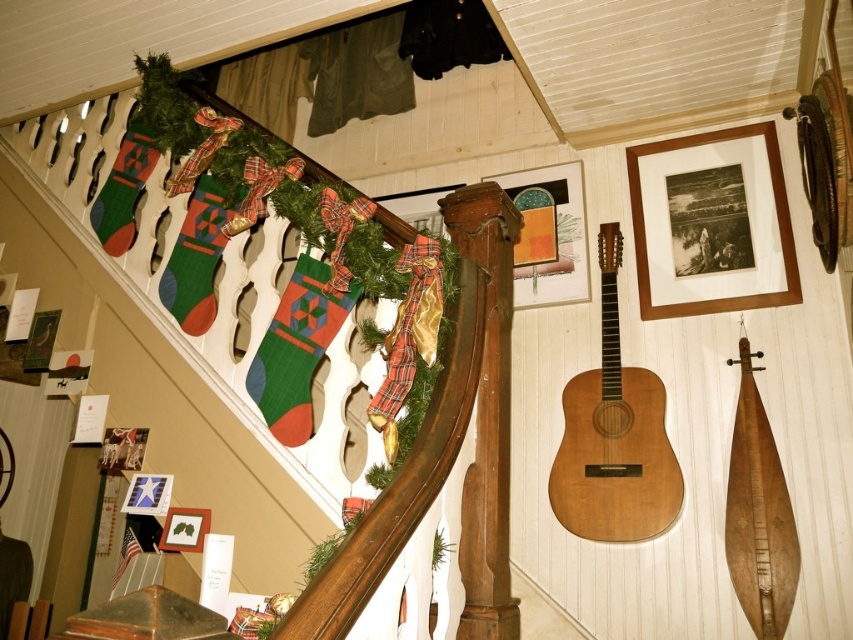
Find the location of `natural wood guitar at center`. natural wood guitar at center is located at coordinates (614, 436).

Is natural wood guitar at center to the left of wooden picture frame at upper right from the viewer's perspective?

Indeed, natural wood guitar at center is positioned on the left side of wooden picture frame at upper right.

Where is `natural wood guitar at center`? natural wood guitar at center is located at coordinates (614, 436).

Can you confirm if natural wood guitar at center is positioned to the right of wooden guitar at center-right?

No, natural wood guitar at center is not to the right of wooden guitar at center-right.

How much distance is there between natural wood guitar at center and wooden guitar at center-right?

natural wood guitar at center and wooden guitar at center-right are 13.47 inches apart from each other.

Describe the element at coordinates (614, 436) in the screenshot. The width and height of the screenshot is (853, 640). I see `natural wood guitar at center` at that location.

I want to click on natural wood guitar at center, so click(614, 436).

Is point (729, 509) behind point (635, 177)?

No.

Is wooden guitar at center-right to the left of wooden picture frame at upper right from the viewer's perspective?

No, wooden guitar at center-right is not to the left of wooden picture frame at upper right.

Who is more distant from viewer, (741, 352) or (744, 131)?

Point (744, 131)

Locate an element on the screen. The image size is (853, 640). wooden guitar at center-right is located at coordinates (758, 513).